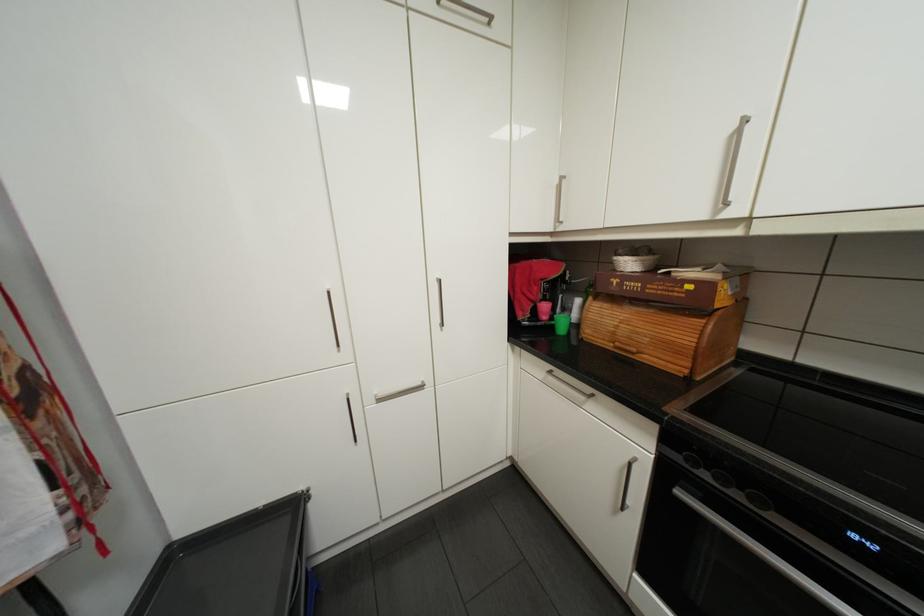
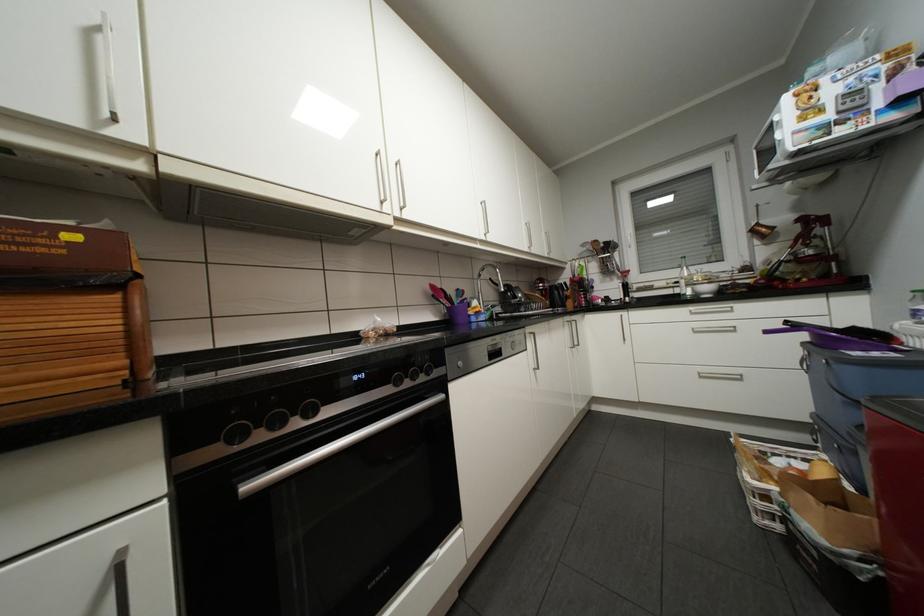
Question: How did the camera likely rotate?

Choices:
 (A) Left
 (B) Right
 (C) Up
 (D) Down

Answer: (B)